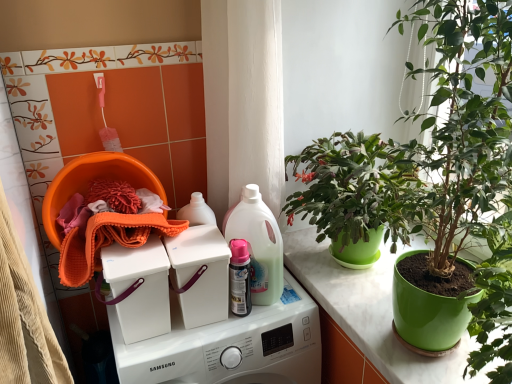
The height and width of the screenshot is (384, 512). In order to click on vacant space in front of white plastic washing machine at center, which ranks as the second washing machine in bottom-to-top order in this screenshot , I will do `click(184, 342)`.